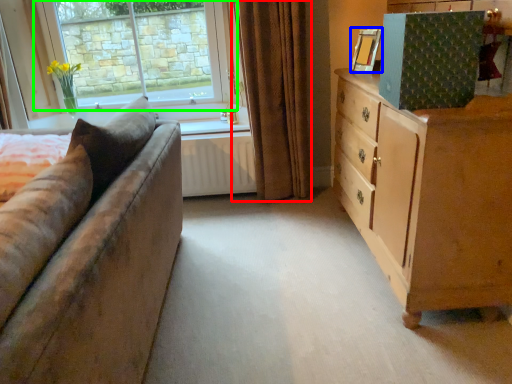
Question: Estimate the real-world distances between objects in this image. Which object is closer to curtain (highlighted by a red box), picture frame (highlighted by a blue box) or window (highlighted by a green box)?

Choices:
 (A) picture frame
 (B) window

Answer: (A)